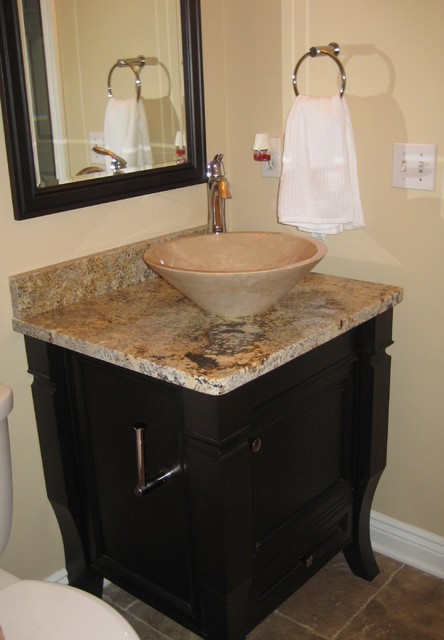
Where is `light switch`? This screenshot has height=640, width=444. light switch is located at coordinates (431, 164).